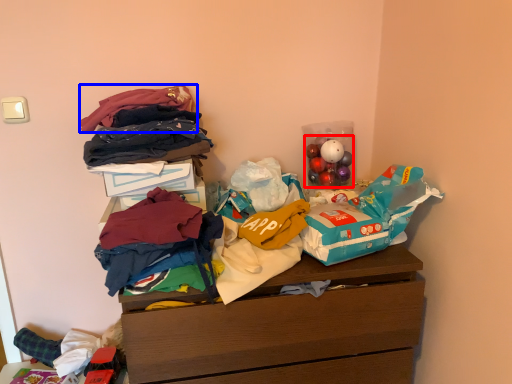
Question: Which point is further to the camera, toy (highlighted by a red box) or clothing (highlighted by a blue box)?

Choices:
 (A) toy
 (B) clothing

Answer: (A)